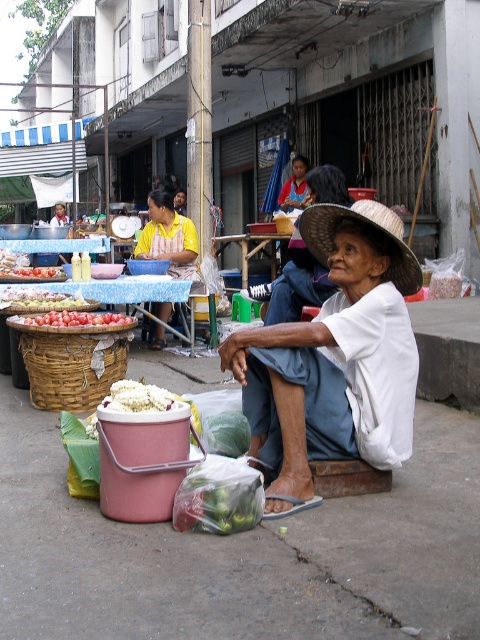
You are standing at the entrance of the market and see the woven brown basket at lower left. Where exactly is it positioned in relation to the pink bucket with fresh produce?

The woven brown basket at lower left is located to the left of the pink bucket with fresh produce.

You are standing at the street market and want to know which of the two points, point (92, 378) or point (331, 208), is closer to you. Can you determine this based on their positions?

Point (92, 378) is closer to you than point (331, 208) because it is further to the viewer.